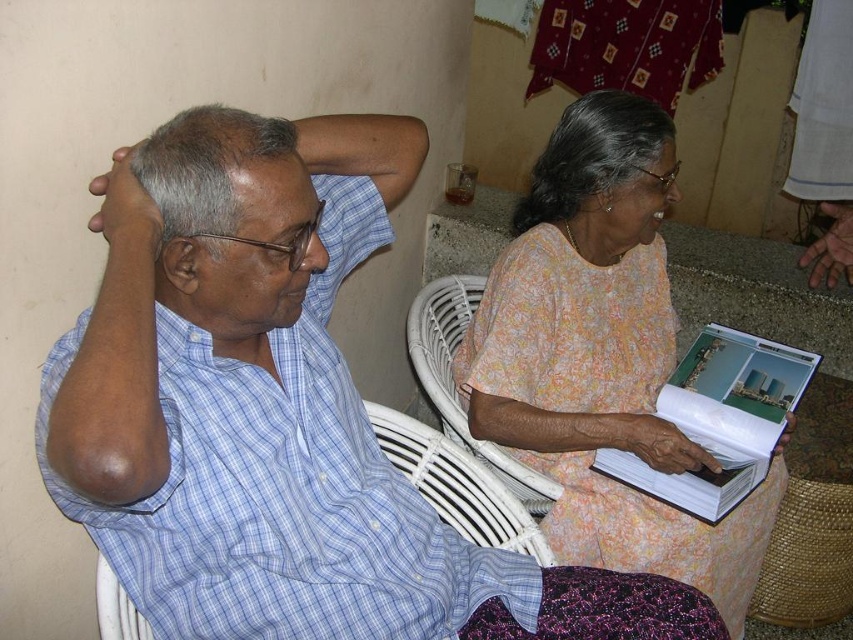
You are a photographer standing at a distance of 25 inches from the blue plaid shirt at left. Can you take a clear photo of it without moving closer?

The blue plaid shirt at left is 30.00 inches away from the camera, so you are currently 5 inches too far to take a clear photo without moving closer.

You are designing a display stand for a clothing store and need to arrange two blue shirts. The matte blue shirt at left and the matte blue shirt at upper left. Which shirt should you place on the wider hanger?

The matte blue shirt at left should be placed on the wider hanger because its width is larger than the matte blue shirt at upper left.

You are organizing a photo album and need to place the matte blue shirt at left and the matte blue shirt at upper left in order of size. Which one should come first?

The matte blue shirt at left is larger in size than the matte blue shirt at upper left, so it should come first in the photo album.